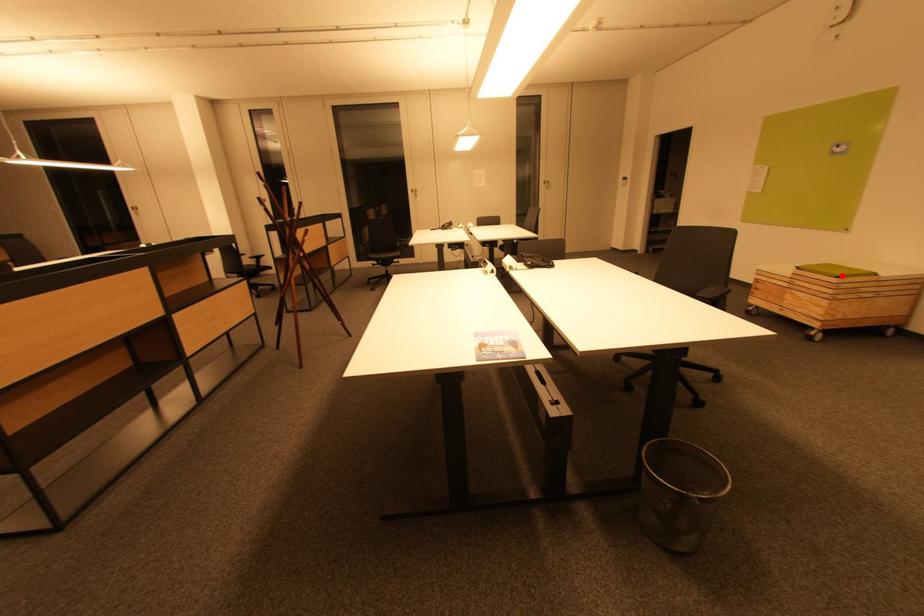
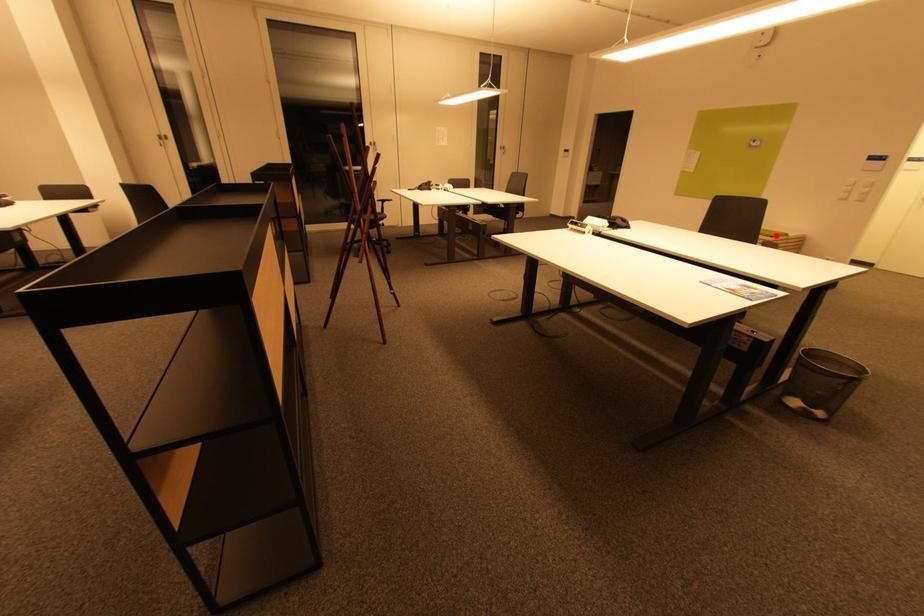
I am providing you with two images of the same scene from different viewpoints. A red point is marked on the first image and another point is marked on the second image. Is the marked point in image1 the same physical position as the marked point in image2?

Yes